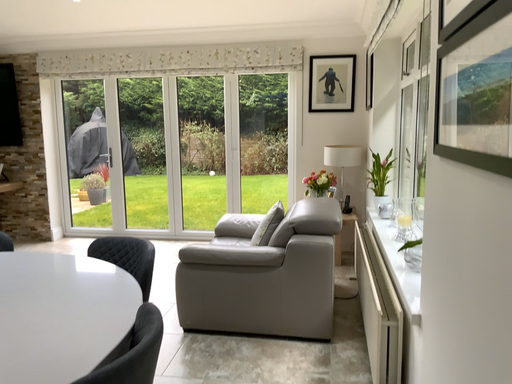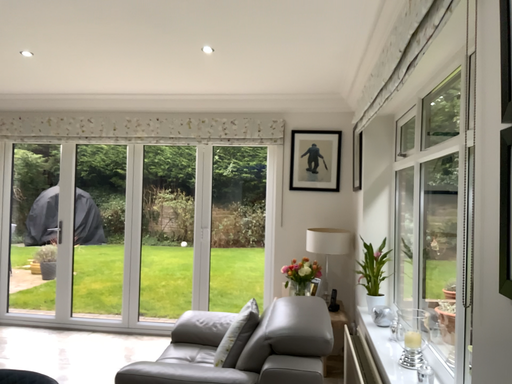
Question: How did the camera likely rotate when shooting the video?

Choices:
 (A) rotated upward
 (B) rotated downward

Answer: (A)